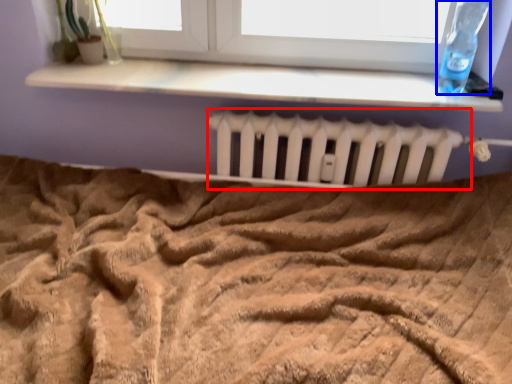
Question: Which point is closer to the camera, radiator (highlighted by a red box) or bottle (highlighted by a blue box)?

Choices:
 (A) radiator
 (B) bottle

Answer: (B)